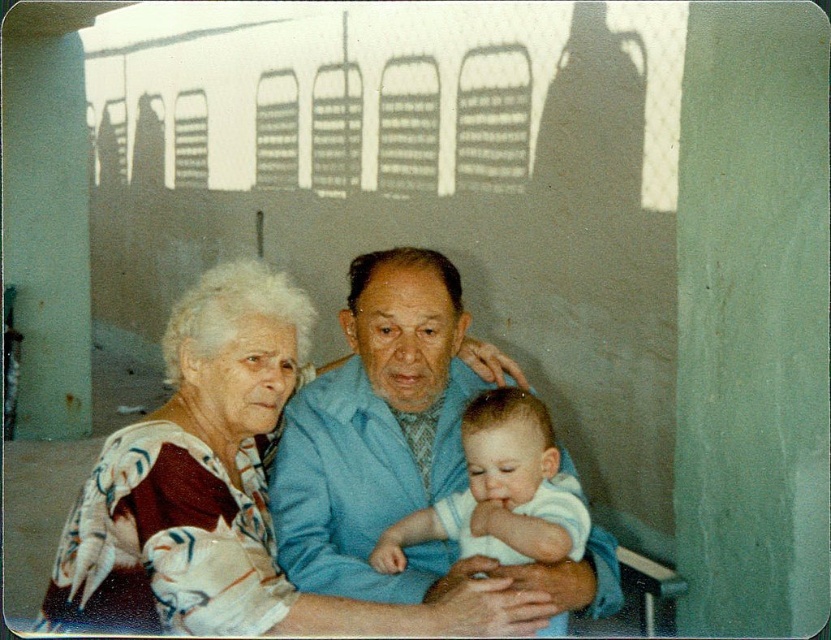
What is the object located at the coordinates point (225, 492)?

The object at point (225, 492) is the printed fabric shawl at center.

You are an interior designer assessing the placement of the printed fabric shawl at center and the blue fabric jacket at center in the image. Which item occupies a smaller vertical space in the scene?

The printed fabric shawl at center is not as tall as the blue fabric jacket at center, so it occupies a smaller vertical space.